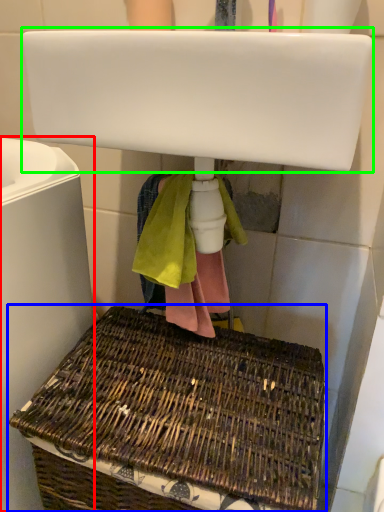
Question: Estimate the real-world distances between objects in this image. Which object is closer to bath (highlighted by a red box), picnic basket (highlighted by a blue box) or sink (highlighted by a green box)?

Choices:
 (A) picnic basket
 (B) sink

Answer: (A)